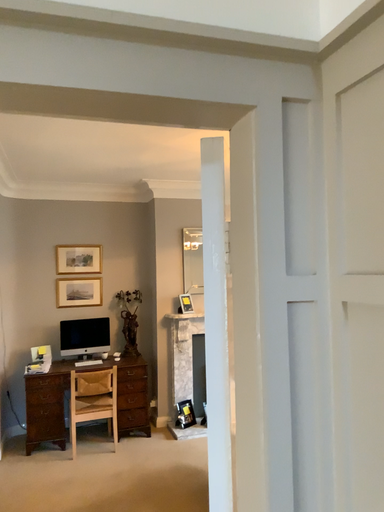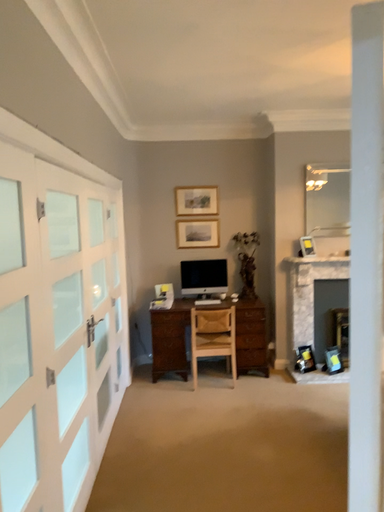
Question: How did the camera likely rotate when shooting the video?

Choices:
 (A) rotated right
 (B) rotated left

Answer: (B)